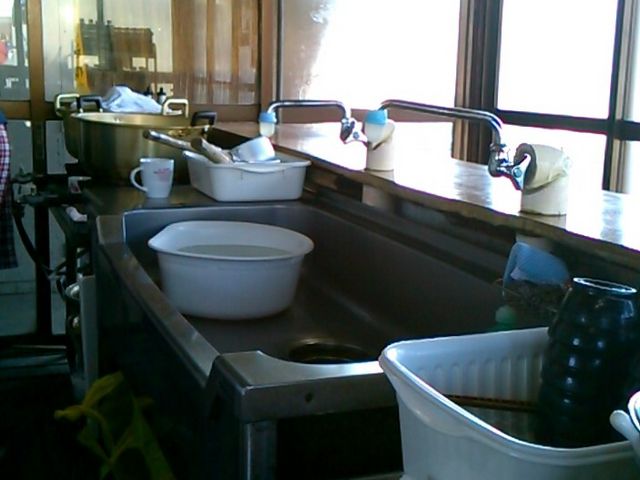
Identify the location of white coffee cup. (157, 174).